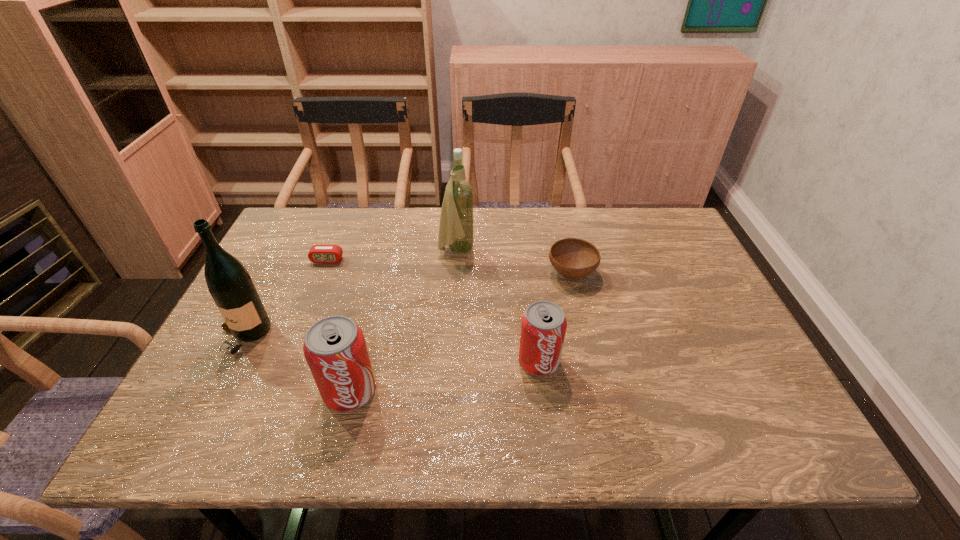
The height and width of the screenshot is (540, 960). Identify the location of vacant place for an extra soda can on the right. (707, 334).